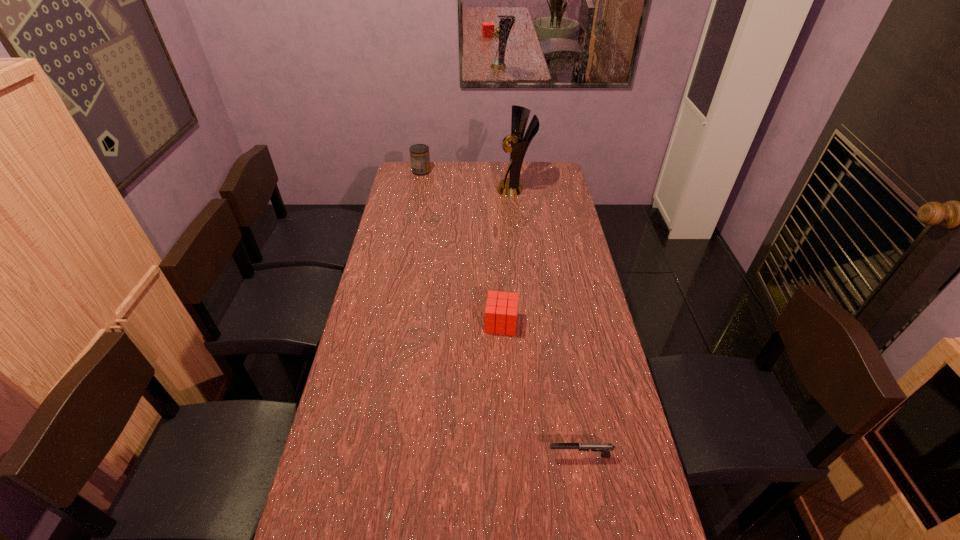
Where is `free space located at the front of the second farthest object, where the globe is visible`? free space located at the front of the second farthest object, where the globe is visible is located at coordinates tap(474, 189).

This screenshot has height=540, width=960. What are the coordinates of `free space located 0.340m on the front of the third shortest object` in the screenshot? It's located at pyautogui.click(x=413, y=214).

This screenshot has height=540, width=960. What are the coordinates of `vacant space located 0.320m on the back of the third farthest object` in the screenshot? It's located at (498, 253).

I want to click on free space located at the muzzle end of the nearest object, so click(x=441, y=456).

The image size is (960, 540). I want to click on vacant space situated at the muzzle end of the nearest object, so pyautogui.click(x=486, y=456).

Find the location of a particular element. vacant space located 0.200m at the muzzle end of the nearest object is located at coordinates (474, 456).

Where is `award that is at the far edge`? The height and width of the screenshot is (540, 960). award that is at the far edge is located at coordinates (510, 187).

You are a GUI agent. You are given a task and a screenshot of the screen. Output one action in this format:
    pyautogui.click(x=<x>, y=<y>)
    Task: Click on the can that is at the far edge
    Image resolution: width=960 pixels, height=540 pixels.
    Given the screenshot: What is the action you would take?
    pyautogui.click(x=419, y=153)

You are a GUI agent. You are given a task and a screenshot of the screen. Output one action in this format:
    pyautogui.click(x=<x>, y=<y>)
    Task: Click on the object that is at the left edge
    
    Given the screenshot: What is the action you would take?
    pyautogui.click(x=419, y=153)

Where is `award that is at the right edge`? Image resolution: width=960 pixels, height=540 pixels. award that is at the right edge is located at coordinates (510, 187).